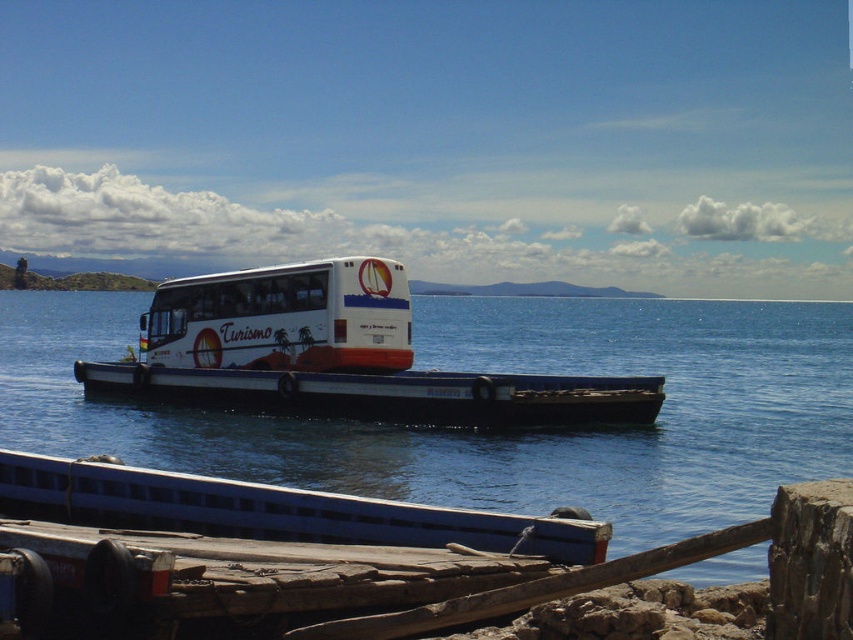
Question: Estimate the real-world distances between objects in this image. Which object is closer to the white glossy bus at center?

Choices:
 (A) blue painted wood boat at lower center
 (B) white matte boat at center
 (C) blue water at center

Answer: (B)

Question: Which point is farther to the camera?

Choices:
 (A) (461, 385)
 (B) (318, 353)

Answer: (B)

Question: Is blue painted wood boat at lower center below white glossy bus at center?

Choices:
 (A) yes
 (B) no

Answer: (A)

Question: From the image, what is the correct spatial relationship of blue painted wood boat at lower center in relation to white matte boat at center?

Choices:
 (A) below
 (B) above

Answer: (A)

Question: Is blue water at center bigger than blue painted wood boat at lower center?

Choices:
 (A) yes
 (B) no

Answer: (A)

Question: Which of the following is the farthest from the observer?

Choices:
 (A) tap(544, 378)
 (B) tap(244, 314)

Answer: (B)